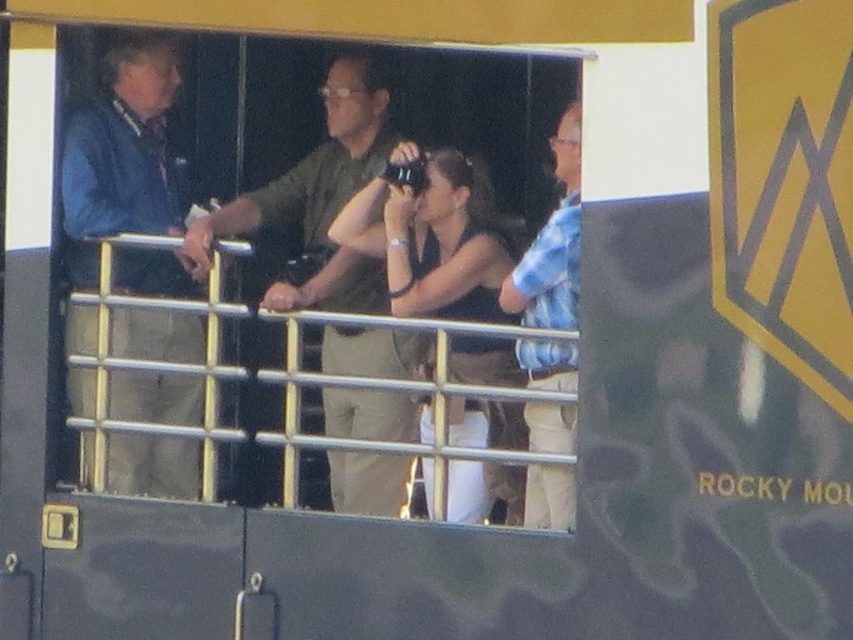
Question: Is blue fabric jacket at left further to the viewer compared to blue striped shirt at right?

Choices:
 (A) no
 (B) yes

Answer: (B)

Question: Does transparent glass at center have a lesser width compared to blue fabric jacket at left?

Choices:
 (A) no
 (B) yes

Answer: (A)

Question: Does blue fabric jacket at left have a greater width compared to blue striped shirt at right?

Choices:
 (A) no
 (B) yes

Answer: (B)

Question: Which is nearer to the black matte tank top at center?

Choices:
 (A) green matte shirt at center
 (B) blue fabric jacket at left

Answer: (A)

Question: Based on their relative distances, which object is nearer to the blue fabric jacket at left?

Choices:
 (A) black matte tank top at center
 (B) transparent glass at center
 (C) green matte shirt at center

Answer: (B)

Question: Which point is farther to the camera?

Choices:
 (A) transparent glass at center
 (B) blue fabric jacket at left
 (C) green matte shirt at center

Answer: (B)